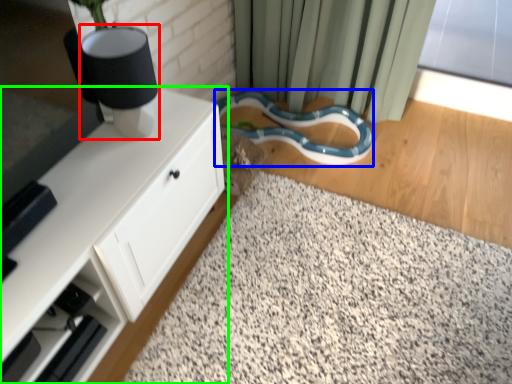
Question: Considering the real-world distances, which object is closest to table lamp (highlighted by a red box)? snake (highlighted by a blue box) or cabinetry (highlighted by a green box).

Choices:
 (A) snake
 (B) cabinetry

Answer: (B)